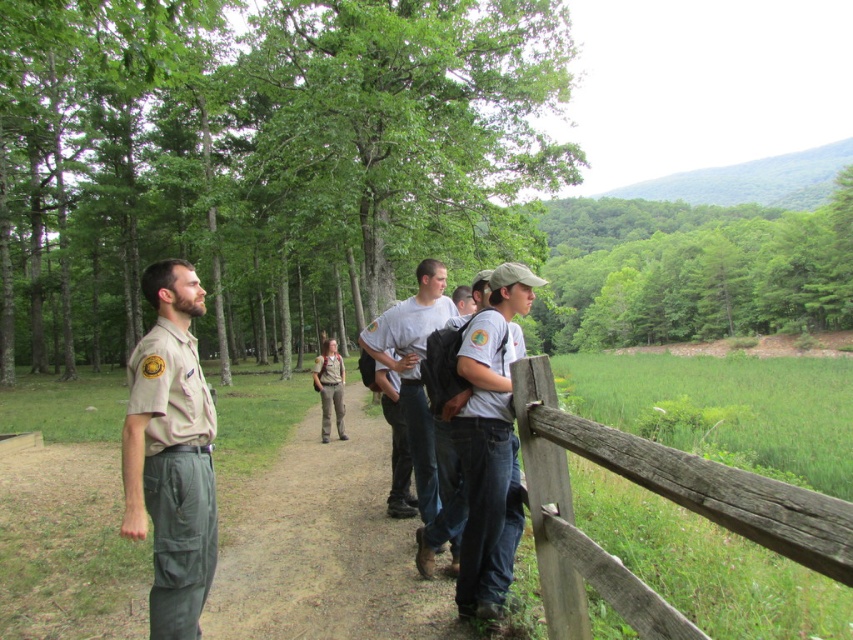
Looking at this image, measure the distance between point (x=834, y=570) and camera.

Point (x=834, y=570) is 1.19 meters from camera.

In the scene shown: Measure the distance between weathered wood fence at lower right and camera.

weathered wood fence at lower right is 3.41 feet from camera.

This screenshot has height=640, width=853. I want to click on weathered wood fence at lower right, so click(659, 493).

Can you confirm if weathered wood fence at lower right is wider than brown uniform at center?

In fact, weathered wood fence at lower right might be narrower than brown uniform at center.

Who is lower down, weathered wood fence at lower right or brown uniform at center?

Positioned lower is brown uniform at center.

Find the location of a particular element. The width and height of the screenshot is (853, 640). weathered wood fence at lower right is located at coordinates (659, 493).

Does weathered wood fence at lower right have a lesser height compared to white cotton shirt at center?

Yes.

Does weathered wood fence at lower right have a larger size compared to white cotton shirt at center?

Incorrect, weathered wood fence at lower right is not larger than white cotton shirt at center.

Find the location of a particular element. The width and height of the screenshot is (853, 640). weathered wood fence at lower right is located at coordinates (659, 493).